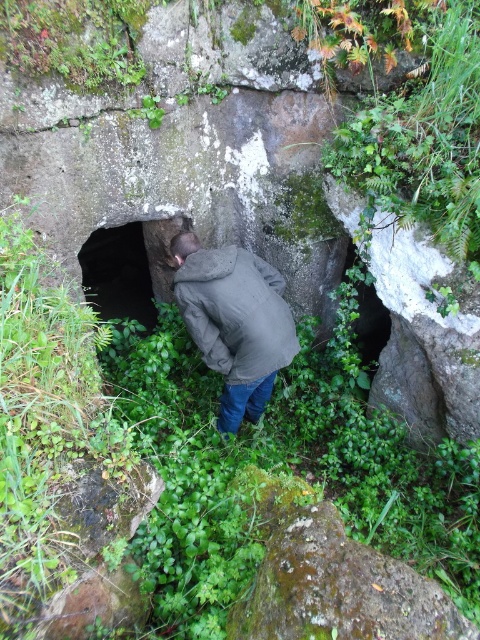
Based on the photo, who is taller, dark gray cotton jacket at center or dark stone cave at center?

dark stone cave at center is taller.

Is dark gray cotton jacket at center further to the viewer compared to dark stone cave at center?

No, it is in front of dark stone cave at center.

Locate an element on the screen. dark gray cotton jacket at center is located at coordinates (236, 312).